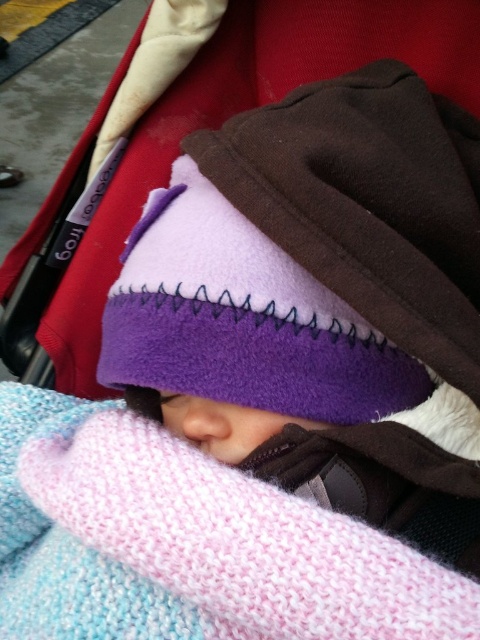
Question: From the image, what is the correct spatial relationship of purple fleece hat at center in relation to pink knitted blanket at center?

Choices:
 (A) right
 (B) left

Answer: (A)

Question: Which of the following is the farthest from the observer?

Choices:
 (A) (52, 611)
 (B) (284, 225)

Answer: (A)

Question: Considering the relative positions of purple fleece hat at center and pink knitted blanket at center in the image provided, where is purple fleece hat at center located with respect to pink knitted blanket at center?

Choices:
 (A) above
 (B) below

Answer: (A)

Question: Does purple fleece hat at center appear on the left side of pink knitted blanket at center?

Choices:
 (A) no
 (B) yes

Answer: (A)